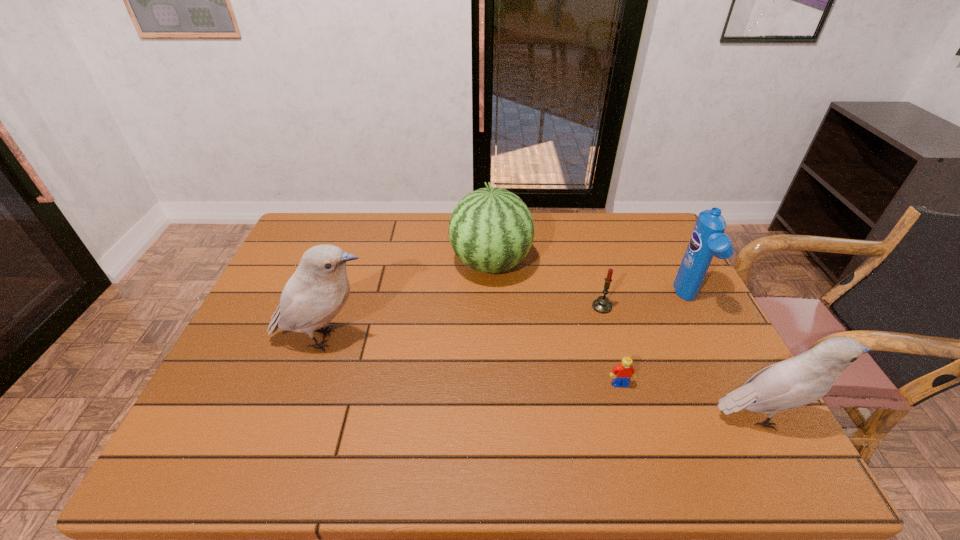
Please point a space for a new bird to maintain equal intervals. Please provide its 2D coordinates. Your answer should be formatted as a tuple, i.e. [(x, y)], where the tuple contains the x and y coordinates of a point satisfying the conditions above.

[(527, 375)]